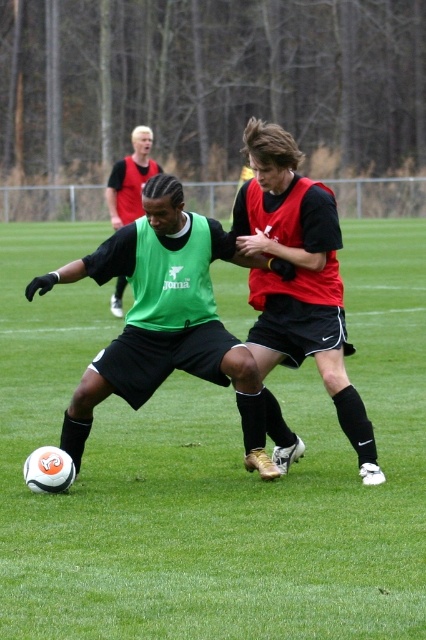
Does green matte soccer ball at lower left come in front of green matte vest at center?

That is True.

Looking at this image, can you confirm if green matte soccer ball at lower left is bigger than green matte vest at center?

No.

Image resolution: width=426 pixels, height=640 pixels. I want to click on green matte soccer ball at lower left, so click(x=213, y=472).

Does red matte jersey at center lie in front of green matte vest at center?

Yes, it is in front of green matte vest at center.

Can you confirm if red matte jersey at center is smaller than green matte vest at center?

Correct, red matte jersey at center occupies less space than green matte vest at center.

Identify the location of red matte jersey at center. This screenshot has height=640, width=426. pos(298,276).

Consider the image. Is green matte jersey at center thinner than green matte vest at center?

Yes.

Is point (319, 234) positioned after point (129, 196)?

That is False.

Is point (282, 154) behind point (155, 173)?

No.

I want to click on green matte jersey at center, so click(x=296, y=276).